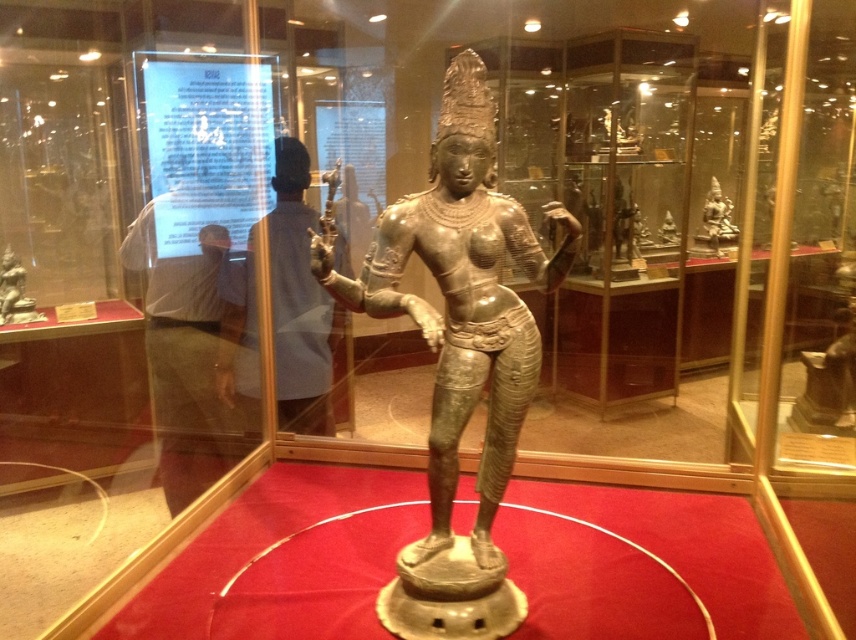
Is blue fabric shirt at upper center wider than matte gray statue at center?

Indeed, blue fabric shirt at upper center has a greater width compared to matte gray statue at center.

Is blue fabric shirt at upper center smaller than matte gray statue at center?

Actually, blue fabric shirt at upper center might be larger than matte gray statue at center.

At what (x,y) coordinates should I click in order to perform the action: click on blue fabric shirt at upper center. Please return your answer as a coordinate pair (x, y). This screenshot has width=856, height=640. Looking at the image, I should click on (183, 356).

Which is more to the right, matte gray statue at center or bronze statue at left?

Positioned to the right is matte gray statue at center.

Looking at this image, which of these two, matte gray statue at center or bronze statue at left, stands taller?

matte gray statue at center is taller.

Is point (272, 312) less distant than point (6, 246)?

That is True.

The height and width of the screenshot is (640, 856). What are the coordinates of `matte gray statue at center` in the screenshot? It's located at (298, 300).

Does shiny bronze statue at center come behind bronze statue at upper right?

No, it is in front of bronze statue at upper right.

Between shiny bronze statue at center and bronze statue at upper right, which one has more height?

Standing taller between the two is shiny bronze statue at center.

Who is more forward, (562, 250) or (730, 202)?

Positioned in front is point (562, 250).

Identify the location of shiny bronze statue at center. [x=459, y=353].